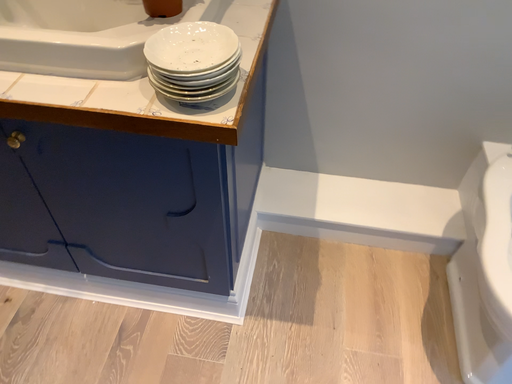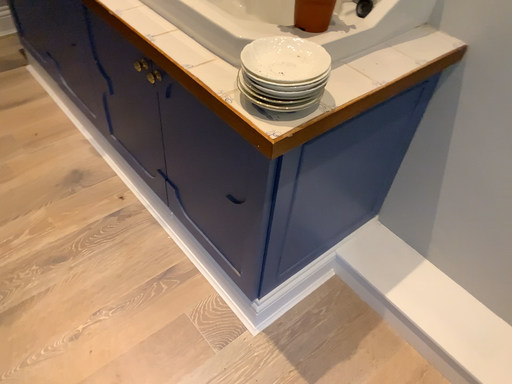
Question: Which way did the camera rotate in the video?

Choices:
 (A) rotated downward
 (B) rotated upward

Answer: (B)